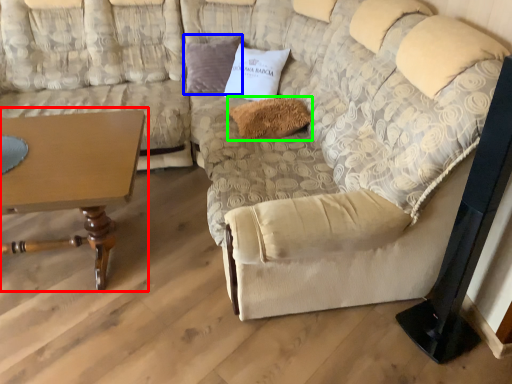
Question: Which object is positioned farthest from table (highlighted by a red box)? Select from pillow (highlighted by a blue box) and pillow (highlighted by a green box).

Choices:
 (A) pillow
 (B) pillow

Answer: (A)